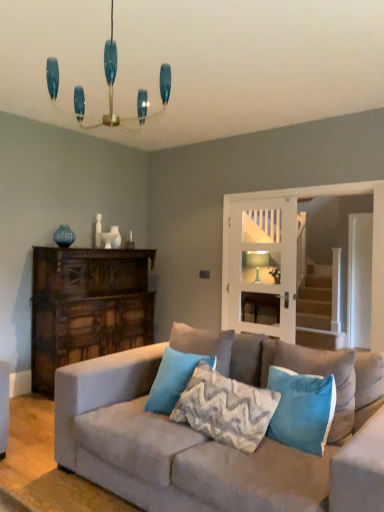
Question: Which direction should I rotate to look at teal velvet pillow at center, which appears as the 4th pillow when viewed from the right, — up or down?

Choices:
 (A) down
 (B) up

Answer: (A)

Question: Is white glass door at center at the right side of teal glass chandelier at upper center?

Choices:
 (A) yes
 (B) no

Answer: (A)

Question: Can you confirm if white glass door at center is positioned to the left of teal glass chandelier at upper center?

Choices:
 (A) yes
 (B) no

Answer: (B)

Question: From a real-world perspective, is white glass door at center located beneath teal glass chandelier at upper center?

Choices:
 (A) no
 (B) yes

Answer: (B)

Question: Can you confirm if white glass door at center is thinner than teal glass chandelier at upper center?

Choices:
 (A) no
 (B) yes

Answer: (B)

Question: From a real-world perspective, is white glass door at center located higher than teal glass chandelier at upper center?

Choices:
 (A) yes
 (B) no

Answer: (B)

Question: From the image's perspective, is white glass door at center on teal glass chandelier at upper center?

Choices:
 (A) yes
 (B) no

Answer: (B)

Question: Is teal velvet pillow at center, which appears as the 4th pillow when viewed from the right, closer to camera compared to suede couch at center?

Choices:
 (A) yes
 (B) no

Answer: (B)

Question: From the image's perspective, is teal velvet pillow at center, which appears as the 4th pillow when viewed from the right, on suede couch at center?

Choices:
 (A) yes
 (B) no

Answer: (A)

Question: Is teal velvet pillow at center, marked as the 1th pillow in a left-to-right arrangement, turned away from suede couch at center?

Choices:
 (A) no
 (B) yes

Answer: (B)

Question: Can you confirm if teal velvet pillow at center, which appears as the 4th pillow when viewed from the right, is wider than suede couch at center?

Choices:
 (A) yes
 (B) no

Answer: (B)

Question: Is teal velvet pillow at center, which appears as the 4th pillow when viewed from the right, bigger than suede couch at center?

Choices:
 (A) no
 (B) yes

Answer: (A)

Question: Can you confirm if teal velvet pillow at center, marked as the 1th pillow in a left-to-right arrangement, is smaller than suede couch at center?

Choices:
 (A) yes
 (B) no

Answer: (A)

Question: Does textured gray pillow at center, marked as the 3th pillow in a left-to-right arrangement, appear on the right side of suede couch at center?

Choices:
 (A) no
 (B) yes

Answer: (A)